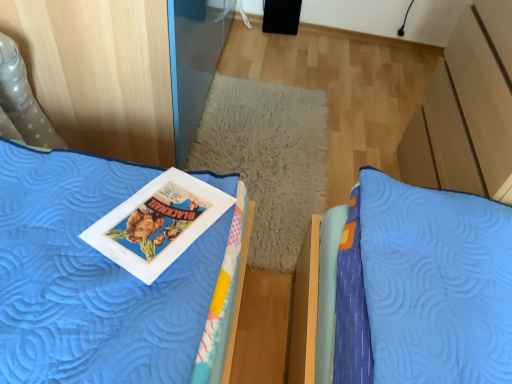
Locate an element on the screen. The height and width of the screenshot is (384, 512). free space to the back side of blue quilted pillow at center is located at coordinates (318, 71).